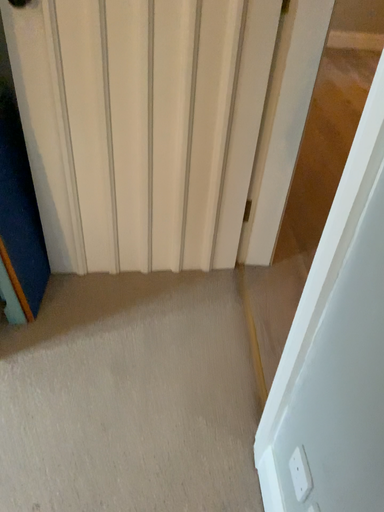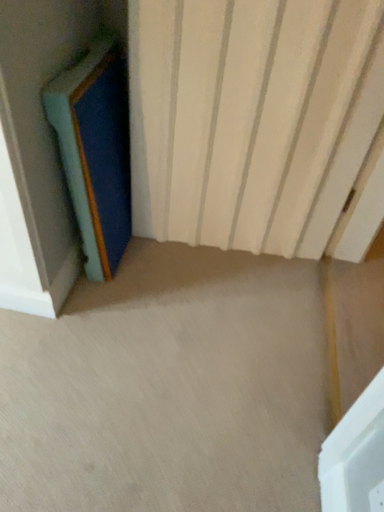
Question: How did the camera likely rotate when shooting the video?

Choices:
 (A) rotated left
 (B) rotated right

Answer: (A)